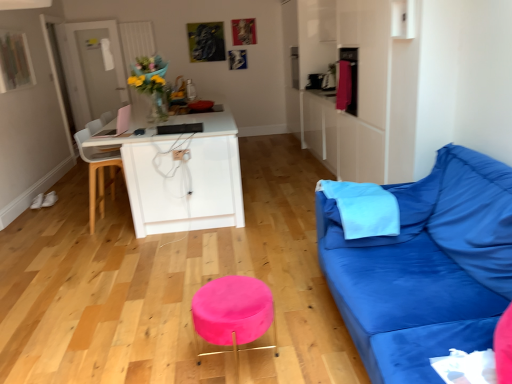
This screenshot has width=512, height=384. I want to click on empty space that is ontop of pink velvet stool at center (from a real-world perspective), so click(x=227, y=290).